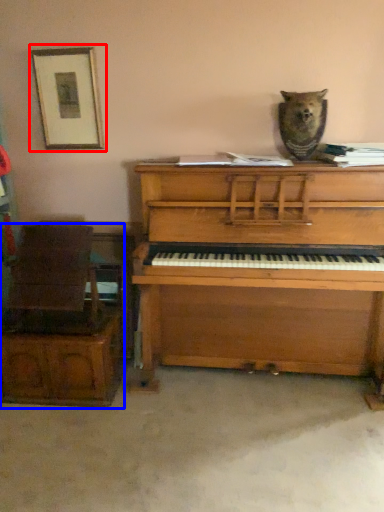
Question: Among these objects, which one is nearest to the camera, picture frame (highlighted by a red box) or furniture (highlighted by a blue box)?

Choices:
 (A) picture frame
 (B) furniture

Answer: (B)